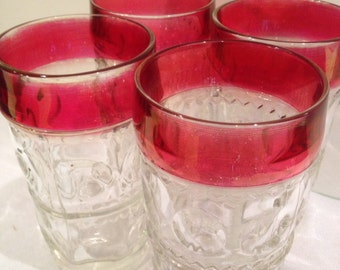
Locate an element on the screen. This screenshot has width=340, height=270. empty space between drinking glasses is located at coordinates (175, 40).